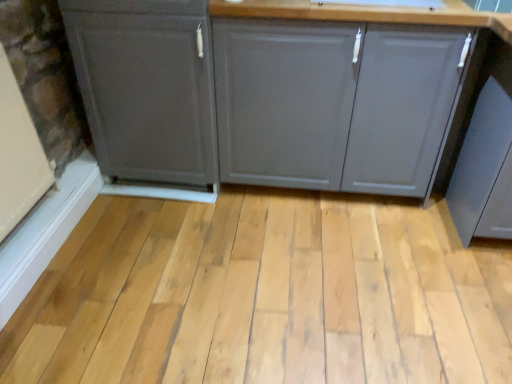
Question: Is matte gray cabinet at center, positioned as the 1th cabinetry in right-to-left order, to the right of natural wood plank at center from the viewer's perspective?

Choices:
 (A) no
 (B) yes

Answer: (B)

Question: Is matte gray cabinet at center, the 2th cabinetry positioned from the left, shorter than natural wood plank at center?

Choices:
 (A) yes
 (B) no

Answer: (B)

Question: Is matte gray cabinet at center, the 2th cabinetry positioned from the left, looking in the opposite direction of natural wood plank at center?

Choices:
 (A) no
 (B) yes

Answer: (A)

Question: Considering the relative sizes of matte gray cabinet at center, positioned as the 1th cabinetry in right-to-left order, and natural wood plank at center in the image provided, is matte gray cabinet at center, positioned as the 1th cabinetry in right-to-left order, thinner than natural wood plank at center?

Choices:
 (A) yes
 (B) no

Answer: (A)

Question: Does matte gray cabinet at center, the 2th cabinetry positioned from the left, turn towards natural wood plank at center?

Choices:
 (A) no
 (B) yes

Answer: (B)

Question: Is matte gray cabinet at center, the 2th cabinetry positioned from the left, further to the viewer compared to natural wood plank at center?

Choices:
 (A) yes
 (B) no

Answer: (A)

Question: Can you confirm if matte gray cabinet at center, positioned as the 1th cabinetry in right-to-left order, is positioned to the left of matte gray cabinet at left, the first cabinetry viewed from the left?

Choices:
 (A) no
 (B) yes

Answer: (A)

Question: Is the depth of matte gray cabinet at center, positioned as the 1th cabinetry in right-to-left order, greater than that of matte gray cabinet at left, which is counted as the second cabinetry, starting from the right?

Choices:
 (A) no
 (B) yes

Answer: (A)

Question: From the image's perspective, is matte gray cabinet at center, the 2th cabinetry positioned from the left, located beneath matte gray cabinet at left, the first cabinetry viewed from the left?

Choices:
 (A) no
 (B) yes

Answer: (B)

Question: Is matte gray cabinet at center, positioned as the 1th cabinetry in right-to-left order, thinner than matte gray cabinet at left, which is counted as the second cabinetry, starting from the right?

Choices:
 (A) yes
 (B) no

Answer: (A)

Question: Is matte gray cabinet at center, the 2th cabinetry positioned from the left, in front of matte gray cabinet at left, the first cabinetry viewed from the left?

Choices:
 (A) yes
 (B) no

Answer: (A)

Question: Considering the relative sizes of matte gray cabinet at center, positioned as the 1th cabinetry in right-to-left order, and matte gray cabinet at left, the first cabinetry viewed from the left, in the image provided, is matte gray cabinet at center, positioned as the 1th cabinetry in right-to-left order, bigger than matte gray cabinet at left, the first cabinetry viewed from the left,?

Choices:
 (A) yes
 (B) no

Answer: (A)

Question: Is natural wood plank at center aimed at matte gray cabinet at center, positioned as the 1th cabinetry in right-to-left order?

Choices:
 (A) yes
 (B) no

Answer: (B)